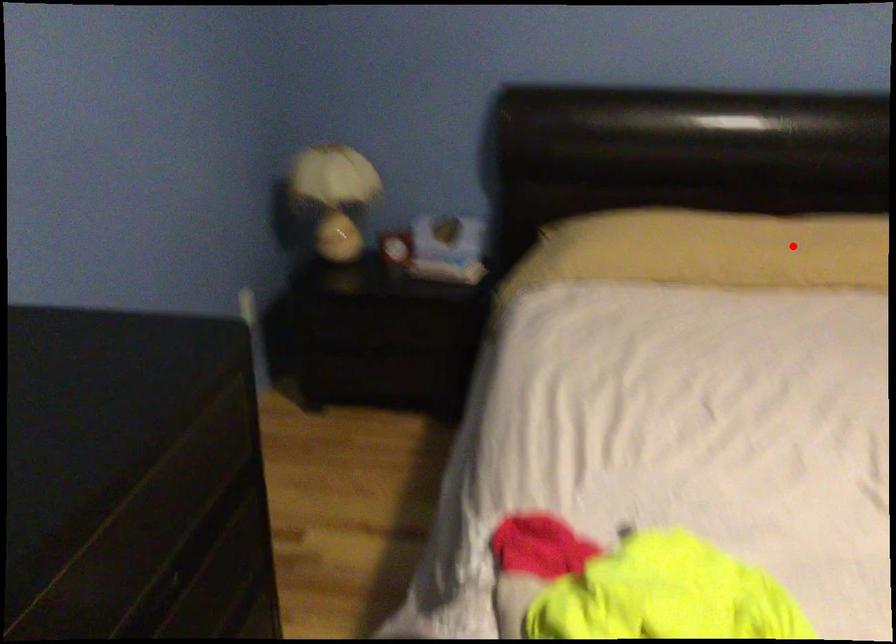
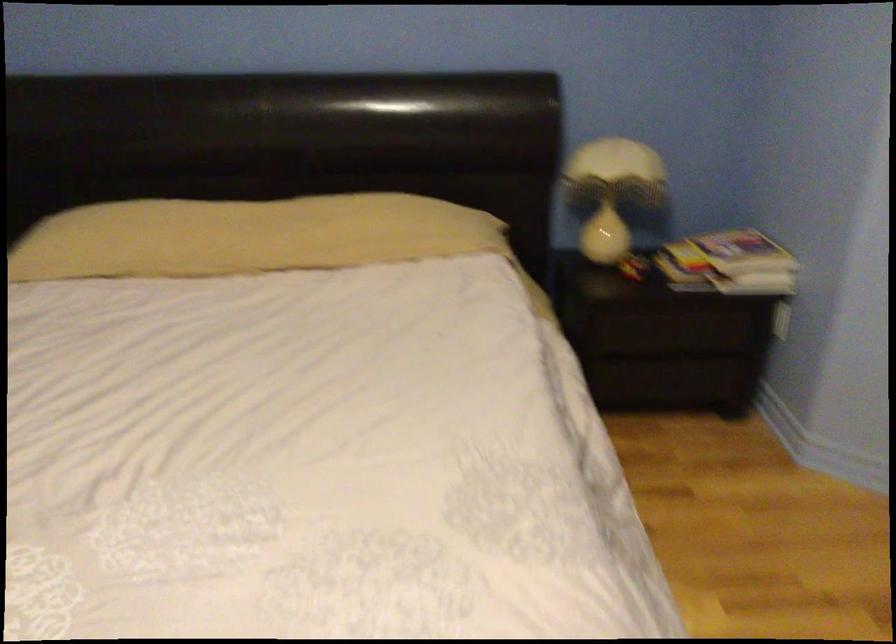
In the second image, find the point that corresponds to the highlighted location in the first image.

(247, 236)